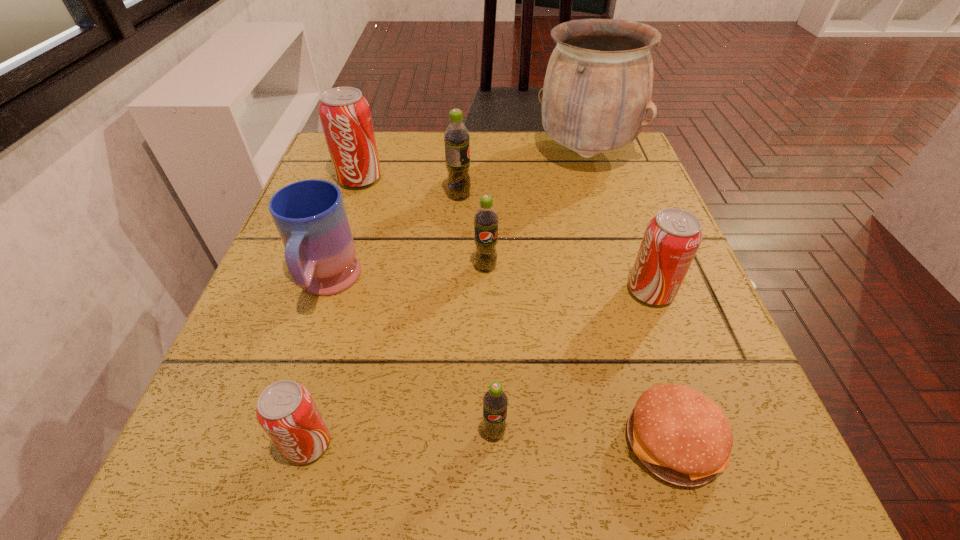
Find the location of a particular element. Image resolution: width=960 pixels, height=540 pixels. object present at the far right corner is located at coordinates (598, 85).

I want to click on object that is at the near right corner, so click(682, 436).

Locate an element on the screen. vacant position at the far edge of the desktop is located at coordinates (531, 136).

This screenshot has height=540, width=960. I want to click on free space at the near edge of the desktop, so click(x=415, y=455).

At what (x,y) coordinates should I click in order to perform the action: click on blank space at the left edge of the desktop. Please return your answer as a coordinate pair (x, y). The height and width of the screenshot is (540, 960). Looking at the image, I should click on (353, 217).

Image resolution: width=960 pixels, height=540 pixels. In order to click on free location at the right edge of the desktop in this screenshot , I will do `click(647, 221)`.

Identify the location of vacant region at the far right corner of the desktop. This screenshot has width=960, height=540. (597, 178).

The image size is (960, 540). I want to click on free space between the farthest red soda can and the urn, so click(472, 166).

Identify the location of free space between the nearest red soda can and the second farthest red soda can. This screenshot has height=540, width=960. (479, 367).

You are a GUI agent. You are given a task and a screenshot of the screen. Output one action in this format:
    pyautogui.click(x=<x>, y=<y>)
    Task: Click on the free space between the second nearest red soda can and the smallest green soda
    This screenshot has width=960, height=540.
    Given the screenshot: What is the action you would take?
    pyautogui.click(x=572, y=362)